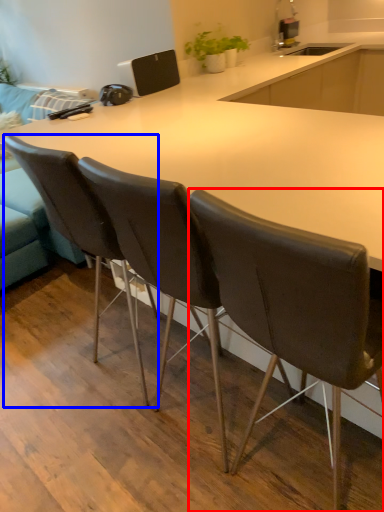
Question: Which of the following is the closest to the observer, chair (highlighted by a red box) or chair (highlighted by a blue box)?

Choices:
 (A) chair
 (B) chair

Answer: (A)